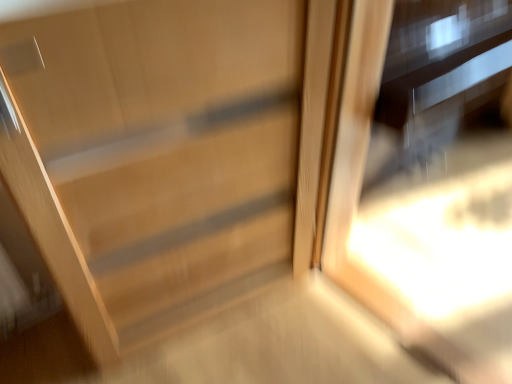
Describe the element at coordinates (411, 238) in the screenshot. Image resolution: width=512 pixels, height=384 pixels. I see `transparent glass window at right` at that location.

Measure the distance between point (x=368, y=135) and camera.

1.43 meters.

Where is `transparent glass window at right`? This screenshot has height=384, width=512. transparent glass window at right is located at coordinates tap(411, 238).

In order to face transparent glass window at right, should I rotate leftwards or rightwards?

To face it directly, rotate right by 23.657 degrees.

What are the coordinates of `transparent glass window at right` in the screenshot? It's located at (411, 238).